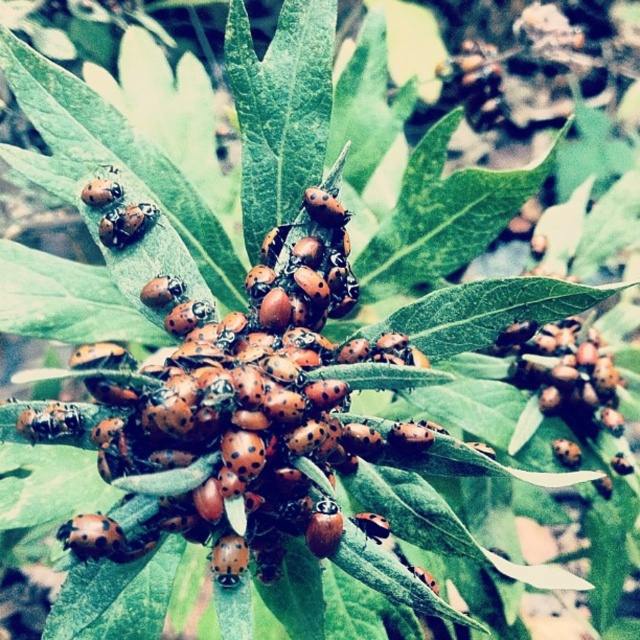
Between green matte leaf at upper right and orange matte ladybug at center, which one is positioned higher?

Positioned higher is orange matte ladybug at center.

Is green matte leaf at upper right wider than orange matte ladybug at center?

Correct, the width of green matte leaf at upper right exceeds that of orange matte ladybug at center.

At what (x,y) coordinates should I click in order to perform the action: click on green matte leaf at upper right. Please return your answer as a coordinate pair (x, y). The height and width of the screenshot is (640, 640). Looking at the image, I should click on (488, 310).